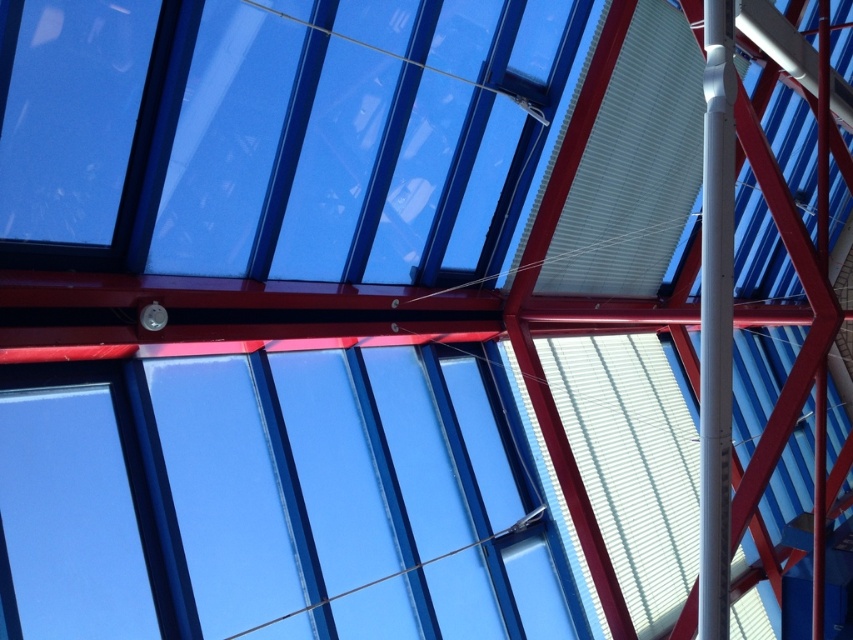
Can you confirm if transparent glass window at center is taller than white glossy pole at center?

Incorrect, transparent glass window at center's height is not larger of white glossy pole at center's.

Who is more distant from viewer, (463, 490) or (723, 545)?

The point (463, 490) is more distant.

Find the location of a particular element. This screenshot has width=853, height=640. transparent glass window at center is located at coordinates (341, 499).